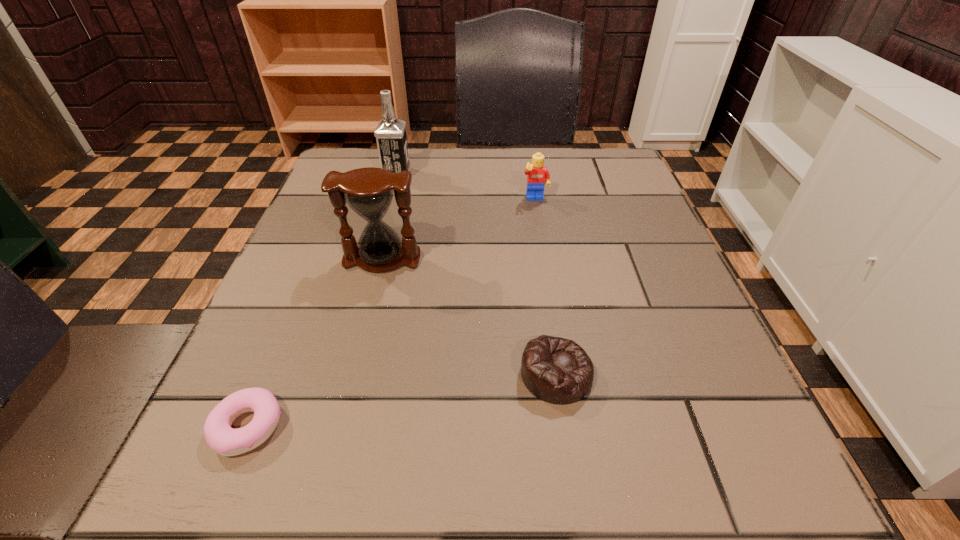
Where is `vacant region that satisfies the following two spatial constraints: 1. on the front label of the vodka; 2. on the back side of the beanbag`? The width and height of the screenshot is (960, 540). vacant region that satisfies the following two spatial constraints: 1. on the front label of the vodka; 2. on the back side of the beanbag is located at coordinates (343, 374).

You are a GUI agent. You are given a task and a screenshot of the screen. Output one action in this format:
    pyautogui.click(x=<x>, y=<y>)
    Task: Click on the free space that satisfies the following two spatial constraints: 1. on the front label of the farthest object; 2. on the back side of the third nearest object
    This screenshot has height=540, width=960.
    Given the screenshot: What is the action you would take?
    pyautogui.click(x=374, y=259)

Find the location of a particular element. blank space that satisfies the following two spatial constraints: 1. on the front label of the hourglass; 2. on the right side of the farthest object is located at coordinates (374, 259).

Where is `vacant space that satisfies the following two spatial constraints: 1. on the front label of the vodka; 2. on the left side of the third farthest object`? Image resolution: width=960 pixels, height=540 pixels. vacant space that satisfies the following two spatial constraints: 1. on the front label of the vodka; 2. on the left side of the third farthest object is located at coordinates pyautogui.click(x=374, y=259).